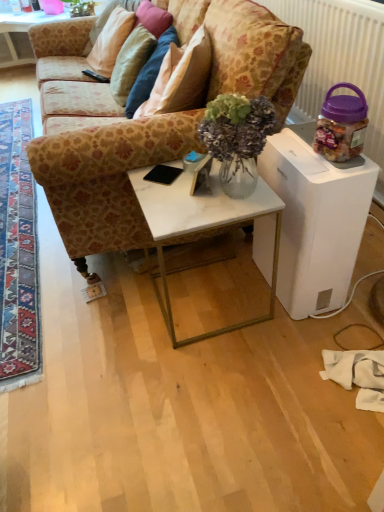
Question: Is white marble table at center, which appears as the first table when viewed from the top, shorter than black matte mobile phone at center?

Choices:
 (A) no
 (B) yes

Answer: (A)

Question: Can you confirm if white marble table at center, the 3th table viewed from the right, is smaller than black matte mobile phone at center?

Choices:
 (A) no
 (B) yes

Answer: (A)

Question: Is white marble table at center, positioned as the 3th table in bottom-to-top order, not close to black matte mobile phone at center?

Choices:
 (A) no
 (B) yes

Answer: (B)

Question: From a real-world perspective, is white marble table at center, positioned as the 3th table in bottom-to-top order, beneath black matte mobile phone at center?

Choices:
 (A) yes
 (B) no

Answer: (A)

Question: Is white marble table at center, the first table from the left, taller than black matte mobile phone at center?

Choices:
 (A) yes
 (B) no

Answer: (A)

Question: Is white marble table at center, the third table viewed from the front, positioned behind black matte mobile phone at center?

Choices:
 (A) no
 (B) yes

Answer: (B)

Question: Is carpeted rug at lower left at the left side of white glossy humidifier at right, which ranks as the second table in top-to-bottom order?

Choices:
 (A) no
 (B) yes

Answer: (B)

Question: From the image's perspective, is carpeted rug at lower left located above white glossy humidifier at right, arranged as the third table when viewed from the left?

Choices:
 (A) yes
 (B) no

Answer: (A)

Question: From the image's perspective, is carpeted rug at lower left beneath white glossy humidifier at right, arranged as the third table when viewed from the left?

Choices:
 (A) no
 (B) yes

Answer: (A)

Question: Does carpeted rug at lower left have a larger size compared to white glossy humidifier at right, which ranks as the 1th table in right-to-left order?

Choices:
 (A) no
 (B) yes

Answer: (B)

Question: Is carpeted rug at lower left oriented towards white glossy humidifier at right, which ranks as the 1th table in right-to-left order?

Choices:
 (A) no
 (B) yes

Answer: (A)

Question: Are carpeted rug at lower left and white glossy humidifier at right, arranged as the third table when viewed from the left, making contact?

Choices:
 (A) no
 (B) yes

Answer: (A)

Question: Is white glossy humidifier at right, which is the 3th table from back to front, oriented away from black plastic remote control at upper left?

Choices:
 (A) no
 (B) yes

Answer: (A)